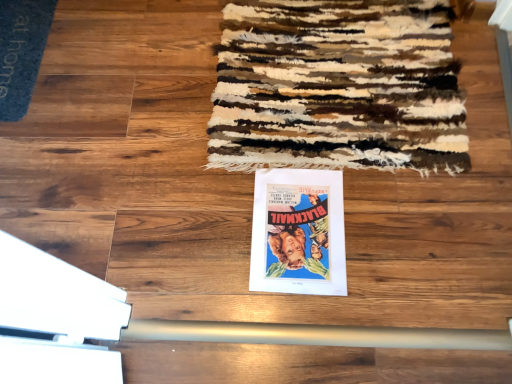
Where is `vacant area situated below textured woolen mat at upper center (from a real-world perspective)`? Image resolution: width=512 pixels, height=384 pixels. vacant area situated below textured woolen mat at upper center (from a real-world perspective) is located at coordinates (340, 75).